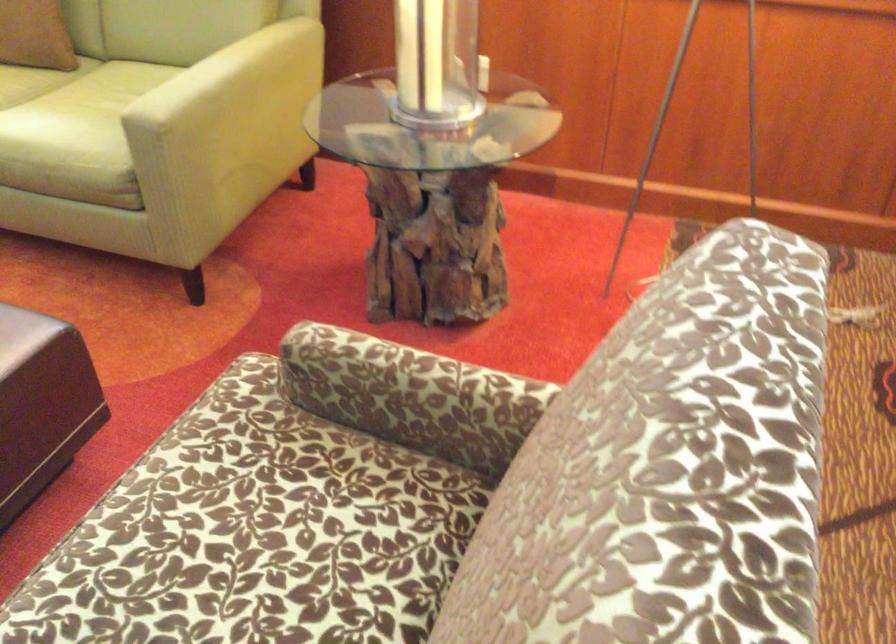
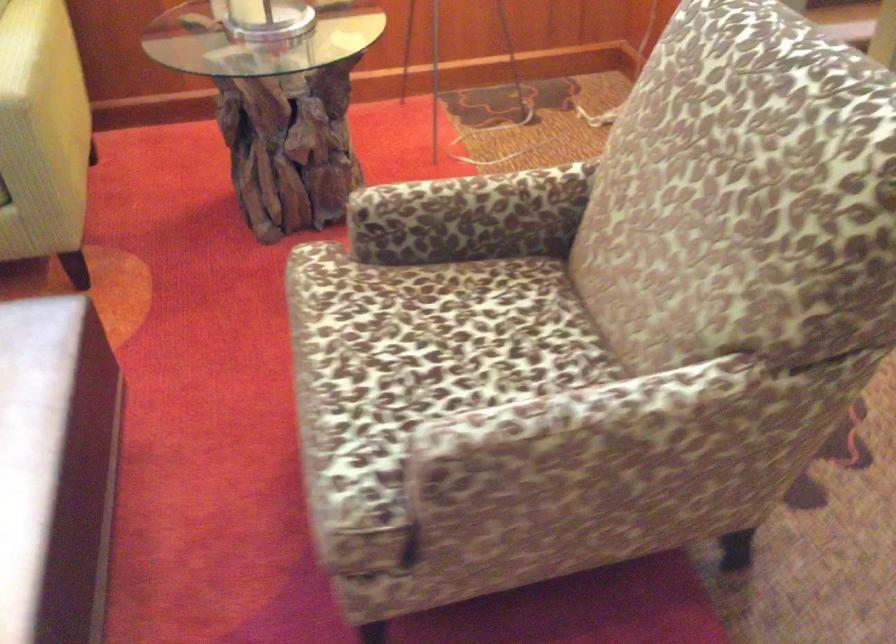
Find the pixel in the second image that matches (248,543) in the first image.

(452, 344)